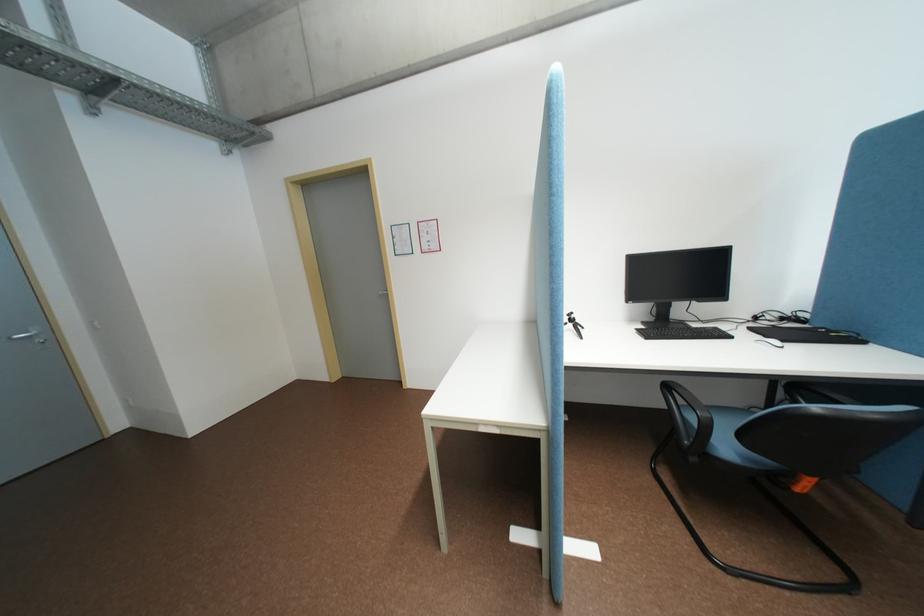
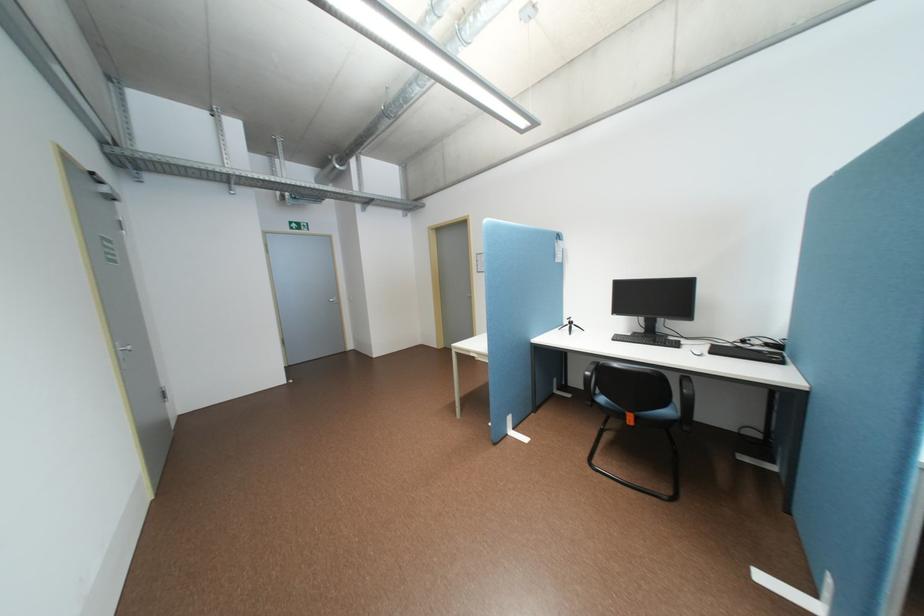
In the second image, find the point that corresponds to (x=740, y=336) in the first image.

(688, 346)